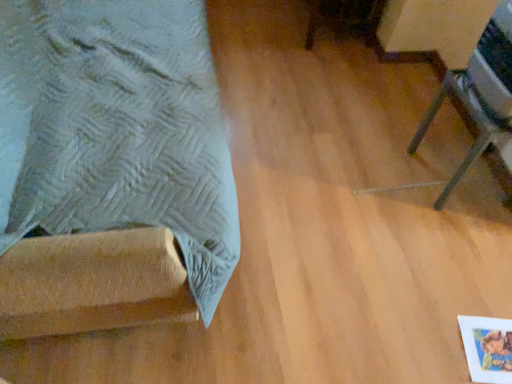
Question: Does metallic silver tripod at right, the first furniture from the right, turn towards suede-like fabric at left, positioned as the second furniture in right-to-left order?

Choices:
 (A) no
 (B) yes

Answer: (B)

Question: Considering the relative positions of metallic silver tripod at right, the second furniture positioned from the left, and suede-like fabric at left, positioned as the second furniture in right-to-left order, in the image provided, is metallic silver tripod at right, the second furniture positioned from the left, to the right of suede-like fabric at left, positioned as the second furniture in right-to-left order, from the viewer's perspective?

Choices:
 (A) no
 (B) yes

Answer: (B)

Question: From the image's perspective, is metallic silver tripod at right, the second furniture positioned from the left, under suede-like fabric at left, positioned as the second furniture in right-to-left order?

Choices:
 (A) no
 (B) yes

Answer: (B)

Question: Is metallic silver tripod at right, the first furniture from the right, behind suede-like fabric at left, positioned as the second furniture in right-to-left order?

Choices:
 (A) yes
 (B) no

Answer: (A)

Question: Is metallic silver tripod at right, the first furniture from the right, outside of suede-like fabric at left, positioned as the second furniture in right-to-left order?

Choices:
 (A) no
 (B) yes

Answer: (B)

Question: Is metallic silver tripod at right, the second furniture positioned from the left, not close to suede-like fabric at left, which ranks as the first furniture in left-to-right order?

Choices:
 (A) no
 (B) yes

Answer: (B)

Question: Does suede-like fabric at left, positioned as the second furniture in right-to-left order, come behind metallic silver tripod at right, the first furniture from the right?

Choices:
 (A) no
 (B) yes

Answer: (A)

Question: Considering the relative sizes of suede-like fabric at left, positioned as the second furniture in right-to-left order, and metallic silver tripod at right, the second furniture positioned from the left, in the image provided, is suede-like fabric at left, positioned as the second furniture in right-to-left order, taller than metallic silver tripod at right, the second furniture positioned from the left,?

Choices:
 (A) no
 (B) yes

Answer: (B)

Question: Considering the relative positions of suede-like fabric at left, positioned as the second furniture in right-to-left order, and metallic silver tripod at right, the second furniture positioned from the left, in the image provided, is suede-like fabric at left, positioned as the second furniture in right-to-left order, to the left of metallic silver tripod at right, the second furniture positioned from the left, from the viewer's perspective?

Choices:
 (A) yes
 (B) no

Answer: (A)

Question: Is metallic silver tripod at right, the second furniture positioned from the left, at the back of suede-like fabric at left, which ranks as the first furniture in left-to-right order?

Choices:
 (A) no
 (B) yes

Answer: (A)

Question: Is suede-like fabric at left, positioned as the second furniture in right-to-left order, facing towards metallic silver tripod at right, the second furniture positioned from the left?

Choices:
 (A) no
 (B) yes

Answer: (B)

Question: Are suede-like fabric at left, which ranks as the first furniture in left-to-right order, and metallic silver tripod at right, the first furniture from the right, beside each other?

Choices:
 (A) yes
 (B) no

Answer: (B)

Question: Choose the correct answer: Is suede-like fabric at left, positioned as the second furniture in right-to-left order, inside metallic silver tripod at right, the first furniture from the right, or outside it?

Choices:
 (A) outside
 (B) inside

Answer: (A)